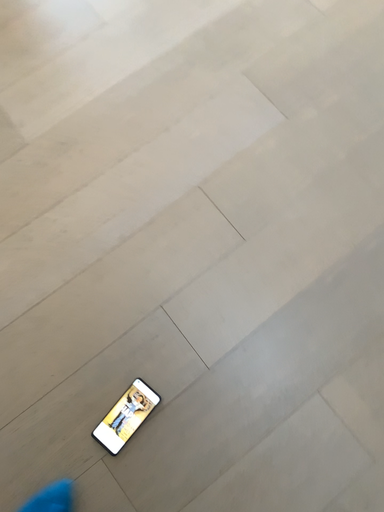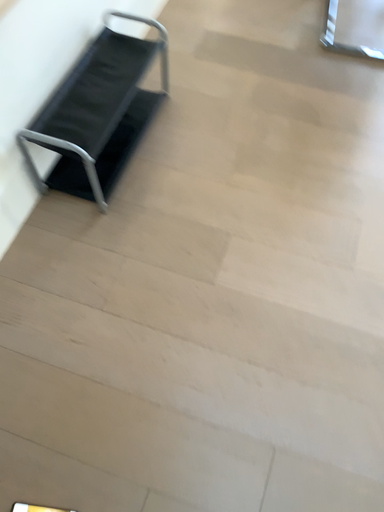
Question: Which way did the camera rotate in the video?

Choices:
 (A) rotated right
 (B) rotated left

Answer: (B)